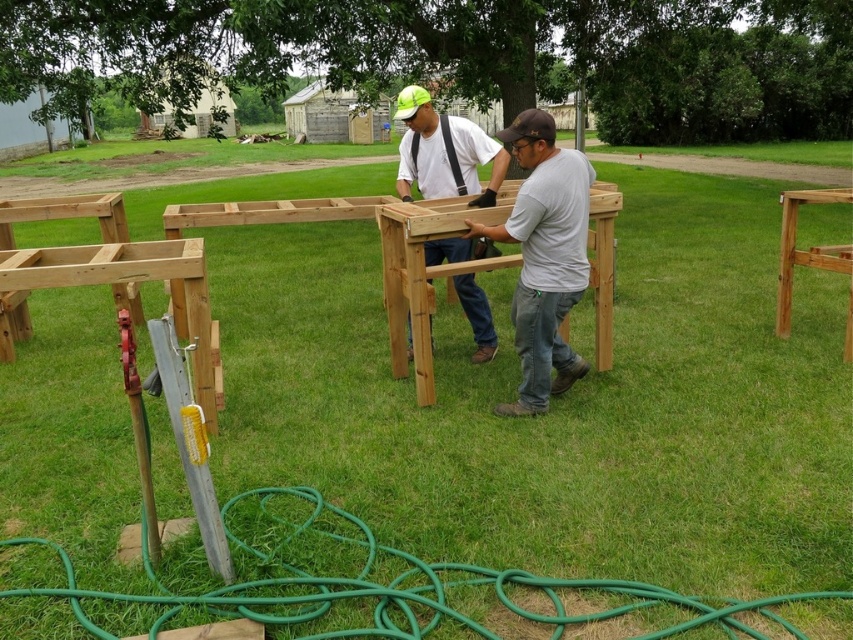
Is natural wood frame at left shorter than matte wood construction at center?

Incorrect, natural wood frame at left's height does not fall short of matte wood construction at center's.

Who is positioned more to the left, natural wood frame at left or matte wood construction at center?

Positioned to the left is natural wood frame at left.

In order to click on natural wood frame at left in this screenshot , I will do tap(111, 276).

Which is in front, point (676, 604) or point (18, 212)?

Point (676, 604)

Does green rubber hose at lower center have a smaller size compared to natural wood frame at left?

Correct, green rubber hose at lower center occupies less space than natural wood frame at left.

Does point (271, 552) come farther from viewer compared to point (45, 259)?

No, it is not.

Where is `green rubber hose at lower center`? green rubber hose at lower center is located at coordinates (399, 589).

Who is lower down, gray matte shirt at center or light brown wood at right?

Positioned lower is gray matte shirt at center.

Image resolution: width=853 pixels, height=640 pixels. What are the coordinates of `gray matte shirt at center` in the screenshot? It's located at (544, 257).